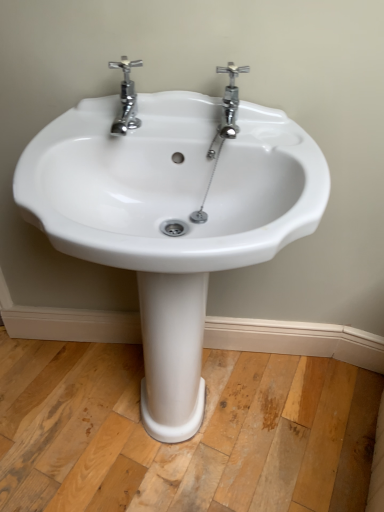
Find the location of a particular element. The height and width of the screenshot is (512, 384). free spot to the left of chrome/metallic faucet at upper center, marked as the 2th tap in a left-to-right arrangement is located at coordinates (162, 126).